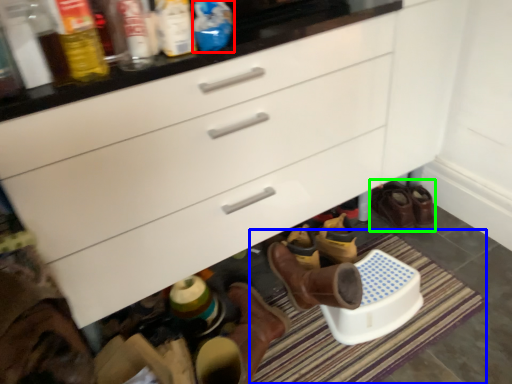
Question: Considering the real-world distances, which object is farthest from bottle (highlighted by a red box)? bath mat (highlighted by a blue box) or footwear (highlighted by a green box)?

Choices:
 (A) bath mat
 (B) footwear

Answer: (B)